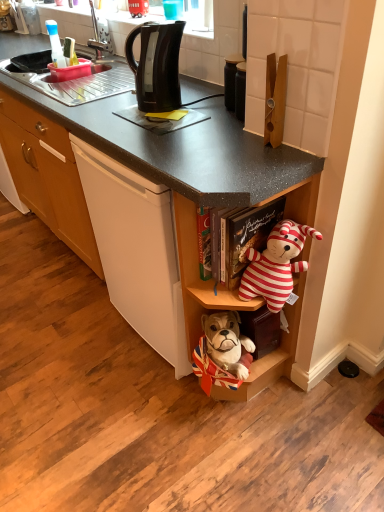
I want to click on wooden shelf at lower center, so click(x=199, y=277).

Measure the distance between point (43,67) and camera.

They are 2.11 meters apart.

What do you see at coordinates (136, 250) in the screenshot? This screenshot has width=384, height=512. I see `black plastic kettle at center` at bounding box center [136, 250].

Where is `striped fabric teddy bear at center-right`? This screenshot has height=512, width=384. striped fabric teddy bear at center-right is located at coordinates (275, 264).

From the picture: How many degrees apart are the facing directions of wooden shelf at lower center and striped fabric teddy bear at center-right?

6.18 degrees.

Can you confirm if wooden shelf at lower center is wider than striped fabric teddy bear at center-right?

Yes, wooden shelf at lower center is wider than striped fabric teddy bear at center-right.

From the image's perspective, would you say wooden shelf at lower center is positioned over striped fabric teddy bear at center-right?

No, from the image's perspective, wooden shelf at lower center is not over striped fabric teddy bear at center-right.

Does black plastic kettle at center have a greater width compared to striped fabric teddy bear at center-right?

Indeed, black plastic kettle at center has a greater width compared to striped fabric teddy bear at center-right.

Is point (111, 201) in front of point (244, 278)?

No, it is not.

Which is more to the right, black plastic kettle at center or striped fabric teddy bear at center-right?

Positioned to the right is striped fabric teddy bear at center-right.

Considering the sizes of black matte jar at upper center and striped fabric teddy bear at center-right in the image, is black matte jar at upper center bigger or smaller than striped fabric teddy bear at center-right?

In the image, black matte jar at upper center appears to be smaller than striped fabric teddy bear at center-right.

Is black matte jar at upper center not within striped fabric teddy bear at center-right?

black matte jar at upper center lies outside striped fabric teddy bear at center-right's area.

Is black matte jar at upper center next to striped fabric teddy bear at center-right?

There is a gap between black matte jar at upper center and striped fabric teddy bear at center-right.

Is black plastic kettle at center oriented towards matte plastic sink at upper left?

No, black plastic kettle at center is not aimed at matte plastic sink at upper left.

Measure the distance between black plastic kettle at center and matte plastic sink at upper left.

They are 39.29 inches apart.

Can you confirm if black plastic kettle at center is thinner than matte plastic sink at upper left?

Incorrect, the width of black plastic kettle at center is not less than that of matte plastic sink at upper left.

Is black plastic kettle at center positioned behind matte plastic sink at upper left?

No, black plastic kettle at center is in front of matte plastic sink at upper left.

How different are the orientations of black matte jar at upper center and black plastic kettle at center in degrees?

The facing directions of black matte jar at upper center and black plastic kettle at center are 24.7 degrees apart.

From the image's perspective, which one is positioned higher, black matte jar at upper center or black plastic kettle at center?

black matte jar at upper center is shown above in the image.

Which object is closer to the camera, black matte jar at upper center or black plastic kettle at center?

black plastic kettle at center is closer to the camera.

Is black matte jar at upper center wider or thinner than black plastic kettle at center?

Clearly, black matte jar at upper center has less width compared to black plastic kettle at center.

From a real-world perspective, is matte plastic sink at upper left positioned over black plastic kettle at upper center based on gravity?

Actually, matte plastic sink at upper left is physically below black plastic kettle at upper center in the real world.

How much distance is there between matte plastic sink at upper left and black plastic kettle at upper center?

They are 30.36 inches apart.

Where is `kitchen appliance on the right of matte plastic sink at upper left`? The height and width of the screenshot is (512, 384). kitchen appliance on the right of matte plastic sink at upper left is located at coordinates (156, 65).

From the image's perspective, relative to black plastic kettle at upper center, is matte plastic sink at upper left above or below?

Clearly, from the image's perspective, matte plastic sink at upper left is above black plastic kettle at upper center.

Is black plastic kettle at upper center looking in the opposite direction of black plastic kettle at center?

No, black plastic kettle at upper center's orientation is not away from black plastic kettle at center.

From the image's perspective, who appears lower, black plastic kettle at upper center or black plastic kettle at center?

black plastic kettle at center is shown below in the image.

Is black plastic kettle at upper center further to camera compared to black plastic kettle at center?

Yes, black plastic kettle at upper center is further from the viewer.

Which is behind, point (147, 95) or point (127, 298)?

The point (127, 298) is more distant.

In order to click on shelf below the striped fabric teddy bear at center-right (from the image's perspective) in this screenshot , I will do `click(199, 277)`.

Locate an element on the screen. The height and width of the screenshot is (512, 384). cording machine below the striped fabric teddy bear at center-right (from a real-world perspective) is located at coordinates (136, 250).

Considering their positions, is black matte jar at upper center positioned further to striped fabric teddy bear at center-right than wooden shelf at lower center?

black matte jar at upper center.

Consider the image. Based on their spatial positions, is wooden shelf at lower center or black matte jar at upper center closer to matte plastic sink at upper left?

Among the two, black matte jar at upper center is located nearer to matte plastic sink at upper left.

Which object lies nearer to the anchor point black plastic kettle at center, black plastic kettle at upper center or wooden shelf at lower center?

wooden shelf at lower center.

When comparing their distances from wooden shelf at lower center, does black plastic kettle at center or black matte jar at upper center seem further?

The object further to wooden shelf at lower center is black matte jar at upper center.

Considering their positions, is black matte jar at upper center positioned closer to wooden shelf at lower center than black plastic kettle at center?

black plastic kettle at center is closer to wooden shelf at lower center.

Estimate the real-world distances between objects in this image. Which object is closer to black plastic kettle at center, black matte jar at upper center or black plastic kettle at upper center?

Among the two, black plastic kettle at upper center is located nearer to black plastic kettle at center.

Based on their spatial positions, is black plastic kettle at center or striped fabric teddy bear at center-right closer to black plastic kettle at upper center?

black plastic kettle at center.

Estimate the real-world distances between objects in this image. Which object is closer to black matte jar at upper center, wooden shelf at lower center or striped fabric teddy bear at center-right?

The object closer to black matte jar at upper center is striped fabric teddy bear at center-right.

Find the location of a particular element. The height and width of the screenshot is (512, 384). teddy bear between matte plastic sink at upper left and wooden shelf at lower center vertically is located at coordinates (275, 264).

You are a GUI agent. You are given a task and a screenshot of the screen. Output one action in this format:
    pyautogui.click(x=<x>, y=<y>)
    Task: Click on the kitchen appliance between matte plastic sink at upper left and wooden shelf at lower center vertically
    Image resolution: width=384 pixels, height=512 pixels.
    Given the screenshot: What is the action you would take?
    pyautogui.click(x=156, y=65)

The image size is (384, 512). Find the location of `kitchen appliance between matte plastic sink at upper left and black matte jar at upper center from left to right`. kitchen appliance between matte plastic sink at upper left and black matte jar at upper center from left to right is located at coordinates (156, 65).

Find the location of a particular element. Image resolution: width=384 pixels, height=512 pixels. appliance between black plastic kettle at upper center and wooden shelf at lower center in the vertical direction is located at coordinates (230, 80).